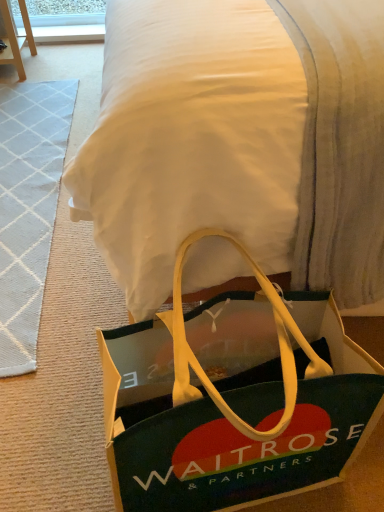
Question: Does white textured rug at left have a greater width compared to green fabric bag at lower center?

Choices:
 (A) no
 (B) yes

Answer: (A)

Question: Is white textured rug at left facing towards green fabric bag at lower center?

Choices:
 (A) yes
 (B) no

Answer: (A)

Question: From the image's perspective, is white textured rug at left under green fabric bag at lower center?

Choices:
 (A) no
 (B) yes

Answer: (B)

Question: From a real-world perspective, is white textured rug at left located higher than green fabric bag at lower center?

Choices:
 (A) no
 (B) yes

Answer: (A)

Question: Does white textured rug at left have a lesser height compared to green fabric bag at lower center?

Choices:
 (A) no
 (B) yes

Answer: (B)

Question: Does white textured rug at left appear on the left side of green fabric bag at lower center?

Choices:
 (A) yes
 (B) no

Answer: (A)

Question: Could you tell me if green fabric bag at lower center is facing white textured rug at left?

Choices:
 (A) no
 (B) yes

Answer: (A)

Question: Are green fabric bag at lower center and white textured rug at left far apart?

Choices:
 (A) no
 (B) yes

Answer: (A)

Question: Does green fabric bag at lower center have a lesser width compared to white textured rug at left?

Choices:
 (A) no
 (B) yes

Answer: (A)

Question: Can you confirm if green fabric bag at lower center is smaller than white textured rug at left?

Choices:
 (A) no
 (B) yes

Answer: (A)

Question: From a real-world perspective, is green fabric bag at lower center below white textured rug at left?

Choices:
 (A) no
 (B) yes

Answer: (A)

Question: From a real-world perspective, is green fabric bag at lower center located higher than white textured rug at left?

Choices:
 (A) yes
 (B) no

Answer: (A)

Question: Is white textured rug at left behind green fabric bag at lower center?

Choices:
 (A) yes
 (B) no

Answer: (A)